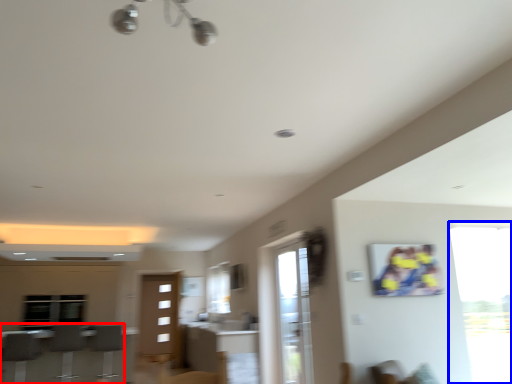
Question: Which object appears closest to the camera in this image, furniture (highlighted by a red box) or window (highlighted by a blue box)?

Choices:
 (A) furniture
 (B) window

Answer: (B)